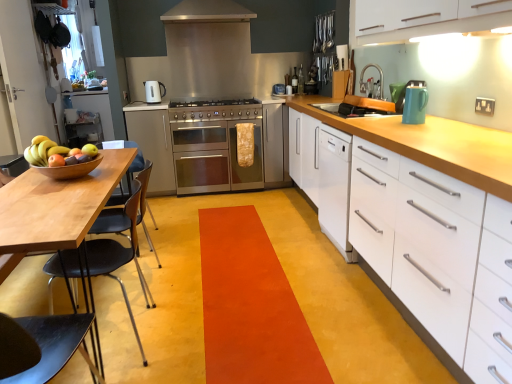
The width and height of the screenshot is (512, 384). In order to click on blank space situated above orange carpet at center (from a real-world perspective) in this screenshot , I will do `click(246, 291)`.